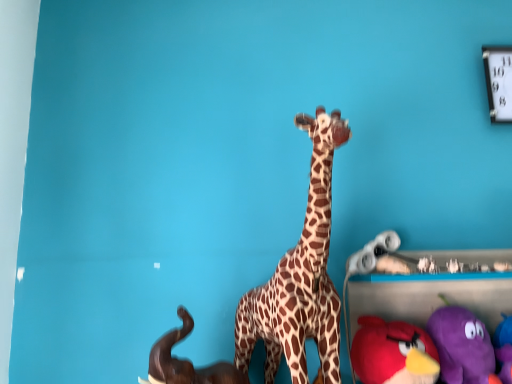
Identify the location of velvet plush bird at lower right, positioned as the 3th toy in left-to-right order. (392, 352).

Measure the distance between purple plush toy at lower right, positioned as the 4th toy in left-to-right order, and camera.

37.13 inches.

What is the approximate width of metallic silver clock at upper right?

metallic silver clock at upper right is 4.26 centimeters wide.

This screenshot has width=512, height=384. Describe the element at coordinates (300, 277) in the screenshot. I see `brown spotted fabric giraffe at center` at that location.

The width and height of the screenshot is (512, 384). Describe the element at coordinates (186, 362) in the screenshot. I see `brown matte elephant at lower left, marked as the 4th toy in a right-to-left arrangement` at that location.

In order to click on white matte toy at center, which is the third toy in right-to-left order in this screenshot , I will do `click(373, 253)`.

From the image's perspective, is white matte toy at center, which is the third toy in right-to-left order, above or below velvet plush bird at lower right, which appears as the second toy when viewed from the right?

white matte toy at center, which is the third toy in right-to-left order, is above velvet plush bird at lower right, which appears as the second toy when viewed from the right.

From a real-world perspective, relative to velvet plush bird at lower right, which appears as the second toy when viewed from the right, is white matte toy at center, which is the third toy in right-to-left order, vertically above or below?

In terms of real-world spatial position, white matte toy at center, which is the third toy in right-to-left order, is above velvet plush bird at lower right, which appears as the second toy when viewed from the right.

Is the position of white matte toy at center, marked as the 2th toy in a left-to-right arrangement, more distant than that of velvet plush bird at lower right, positioned as the 3th toy in left-to-right order?

That is True.

From the picture: Considering the sizes of objects white matte toy at center, marked as the 2th toy in a left-to-right arrangement, and velvet plush bird at lower right, which appears as the second toy when viewed from the right, in the image provided, who is shorter, white matte toy at center, marked as the 2th toy in a left-to-right arrangement, or velvet plush bird at lower right, which appears as the second toy when viewed from the right,?

With less height is white matte toy at center, marked as the 2th toy in a left-to-right arrangement.

Is white matte toy at center, which is the third toy in right-to-left order, aimed at brown spotted fabric giraffe at center?

No, white matte toy at center, which is the third toy in right-to-left order, is not facing towards brown spotted fabric giraffe at center.

Is white matte toy at center, which is the third toy in right-to-left order, closer to camera compared to brown spotted fabric giraffe at center?

No, white matte toy at center, which is the third toy in right-to-left order, is behind brown spotted fabric giraffe at center.

From the image's perspective, relative to brown spotted fabric giraffe at center, is white matte toy at center, which is the third toy in right-to-left order, above or below?

Clearly, from the image's perspective, white matte toy at center, which is the third toy in right-to-left order, is below brown spotted fabric giraffe at center.

Considering the sizes of objects metallic silver clock at upper right and purple plush toy at lower right, the first toy positioned from the right, in the image provided, who is smaller, metallic silver clock at upper right or purple plush toy at lower right, the first toy positioned from the right,?

metallic silver clock at upper right.

From a real-world perspective, is metallic silver clock at upper right beneath purple plush toy at lower right, positioned as the 4th toy in left-to-right order?

No.

Between metallic silver clock at upper right and purple plush toy at lower right, the first toy positioned from the right, which one has smaller width?

Thinner between the two is metallic silver clock at upper right.

Between metallic silver clock at upper right and white matte toy at center, marked as the 2th toy in a left-to-right arrangement, which one has more height?

metallic silver clock at upper right.

In the scene shown: How many degrees apart are the facing directions of metallic silver clock at upper right and white matte toy at center, marked as the 2th toy in a left-to-right arrangement?

metallic silver clock at upper right and white matte toy at center, marked as the 2th toy in a left-to-right arrangement, are facing 5.26 degrees away from each other.

Does point (510, 66) come farther from viewer compared to point (366, 272)?

Yes.

Which is more to the left, purple plush toy at lower right, the first toy positioned from the right, or brown matte elephant at lower left, which appears as the 1th toy when viewed from the left?

Positioned to the left is brown matte elephant at lower left, which appears as the 1th toy when viewed from the left.

How many degrees apart are the facing directions of purple plush toy at lower right, the first toy positioned from the right, and brown matte elephant at lower left, marked as the 4th toy in a right-to-left arrangement?

The angular difference between purple plush toy at lower right, the first toy positioned from the right, and brown matte elephant at lower left, marked as the 4th toy in a right-to-left arrangement, is 0.000751 degrees.

Between purple plush toy at lower right, positioned as the 4th toy in left-to-right order, and brown matte elephant at lower left, which appears as the 1th toy when viewed from the left, which one has more height?

A: Standing taller between the two is purple plush toy at lower right, positioned as the 4th toy in left-to-right order.

Based on the photo, based on their sizes in the image, would you say purple plush toy at lower right, positioned as the 4th toy in left-to-right order, is bigger or smaller than brown matte elephant at lower left, marked as the 4th toy in a right-to-left arrangement?

purple plush toy at lower right, positioned as the 4th toy in left-to-right order, is bigger than brown matte elephant at lower left, marked as the 4th toy in a right-to-left arrangement.

Is velvet plush bird at lower right, positioned as the 3th toy in left-to-right order, directly adjacent to metallic silver clock at upper right?

No, velvet plush bird at lower right, positioned as the 3th toy in left-to-right order, is not in contact with metallic silver clock at upper right.

From the image's perspective, who appears lower, velvet plush bird at lower right, positioned as the 3th toy in left-to-right order, or metallic silver clock at upper right?

velvet plush bird at lower right, positioned as the 3th toy in left-to-right order, from the image's perspective.

Visually, is velvet plush bird at lower right, positioned as the 3th toy in left-to-right order, positioned to the left or to the right of metallic silver clock at upper right?

velvet plush bird at lower right, positioned as the 3th toy in left-to-right order, is positioned on metallic silver clock at upper right's left side.

What's the angular difference between velvet plush bird at lower right, which appears as the second toy when viewed from the right, and metallic silver clock at upper right's facing directions?

velvet plush bird at lower right, which appears as the second toy when viewed from the right, and metallic silver clock at upper right are facing 5.11 degrees away from each other.

Is velvet plush bird at lower right, which appears as the second toy when viewed from the right, completely or partially outside of brown spotted fabric giraffe at center?

Absolutely, velvet plush bird at lower right, which appears as the second toy when viewed from the right, is external to brown spotted fabric giraffe at center.

Is velvet plush bird at lower right, which appears as the second toy when viewed from the right, shorter than brown spotted fabric giraffe at center?

Yes, velvet plush bird at lower right, which appears as the second toy when viewed from the right, is shorter than brown spotted fabric giraffe at center.

Find the location of `giraffe that appears in front of the velvet plush bird at lower right, which appears as the second toy when viewed from the right`. giraffe that appears in front of the velvet plush bird at lower right, which appears as the second toy when viewed from the right is located at coordinates (300, 277).

From a real-world perspective, is velvet plush bird at lower right, positioned as the 3th toy in left-to-right order, below brown spotted fabric giraffe at center?

Correct, in the physical world, velvet plush bird at lower right, positioned as the 3th toy in left-to-right order, is lower than brown spotted fabric giraffe at center.

The height and width of the screenshot is (384, 512). In order to click on toy that is the 3rd one when counting upward from the velvet plush bird at lower right, which appears as the second toy when viewed from the right (from the image's perspective) in this screenshot , I will do `click(373, 253)`.

Where is `the 1st toy below when counting from the brown spotted fabric giraffe at center (from the image's perspective)`? This screenshot has height=384, width=512. the 1st toy below when counting from the brown spotted fabric giraffe at center (from the image's perspective) is located at coordinates (373, 253).

When comparing their distances from metallic silver clock at upper right, does velvet plush bird at lower right, positioned as the 3th toy in left-to-right order, or purple plush toy at lower right, positioned as the 4th toy in left-to-right order, seem further?

Among the two, velvet plush bird at lower right, positioned as the 3th toy in left-to-right order, is located further to metallic silver clock at upper right.

Looking at the image, which one is located further to velvet plush bird at lower right, positioned as the 3th toy in left-to-right order, brown matte elephant at lower left, which appears as the 1th toy when viewed from the left, or brown spotted fabric giraffe at center?

brown matte elephant at lower left, which appears as the 1th toy when viewed from the left, lies further to velvet plush bird at lower right, positioned as the 3th toy in left-to-right order, than the other object.

Looking at the image, which one is located closer to velvet plush bird at lower right, positioned as the 3th toy in left-to-right order, purple plush toy at lower right, the first toy positioned from the right, or white matte toy at center, marked as the 2th toy in a left-to-right arrangement?

purple plush toy at lower right, the first toy positioned from the right, is positioned closer to the anchor velvet plush bird at lower right, positioned as the 3th toy in left-to-right order.

Based on their spatial positions, is purple plush toy at lower right, the first toy positioned from the right, or velvet plush bird at lower right, which appears as the second toy when viewed from the right, further from brown matte elephant at lower left, marked as the 4th toy in a right-to-left arrangement?

The object further to brown matte elephant at lower left, marked as the 4th toy in a right-to-left arrangement, is purple plush toy at lower right, the first toy positioned from the right.

When comparing their distances from brown spotted fabric giraffe at center, does brown matte elephant at lower left, which appears as the 1th toy when viewed from the left, or metallic silver clock at upper right seem further?

Among the two, metallic silver clock at upper right is located further to brown spotted fabric giraffe at center.

Which object lies further to the anchor point metallic silver clock at upper right, white matte toy at center, marked as the 2th toy in a left-to-right arrangement, or brown spotted fabric giraffe at center?

Based on the image, brown spotted fabric giraffe at center appears to be further to metallic silver clock at upper right.

Looking at the image, which one is located closer to velvet plush bird at lower right, positioned as the 3th toy in left-to-right order, brown spotted fabric giraffe at center or white matte toy at center, which is the third toy in right-to-left order?

Among the two, white matte toy at center, which is the third toy in right-to-left order, is located nearer to velvet plush bird at lower right, positioned as the 3th toy in left-to-right order.

Based on their spatial positions, is white matte toy at center, marked as the 2th toy in a left-to-right arrangement, or velvet plush bird at lower right, which appears as the second toy when viewed from the right, closer to brown matte elephant at lower left, which appears as the 1th toy when viewed from the left?

velvet plush bird at lower right, which appears as the second toy when viewed from the right, lies closer to brown matte elephant at lower left, which appears as the 1th toy when viewed from the left, than the other object.

The width and height of the screenshot is (512, 384). I want to click on toy between brown matte elephant at lower left, which appears as the 1th toy when viewed from the left, and velvet plush bird at lower right, positioned as the 3th toy in left-to-right order, so click(x=373, y=253).

The width and height of the screenshot is (512, 384). What are the coordinates of `giraffe between brown matte elephant at lower left, which appears as the 1th toy when viewed from the left, and velvet plush bird at lower right, which appears as the second toy when viewed from the right` in the screenshot? It's located at (300, 277).

At what (x,y) coordinates should I click in order to perform the action: click on giraffe between brown matte elephant at lower left, which appears as the 1th toy when viewed from the left, and metallic silver clock at upper right, in the horizontal direction. Please return your answer as a coordinate pair (x, y). This screenshot has width=512, height=384. Looking at the image, I should click on (300, 277).

Locate an element on the screen. giraffe between brown matte elephant at lower left, marked as the 4th toy in a right-to-left arrangement, and purple plush toy at lower right, positioned as the 4th toy in left-to-right order is located at coordinates (300, 277).